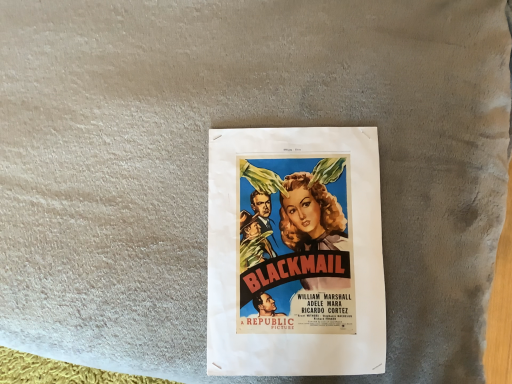
Find the location of a particular element. Image resolution: width=512 pixels, height=384 pixels. empty space that is ontop of matte paper poster at center (from a real-world perspective) is located at coordinates (296, 252).